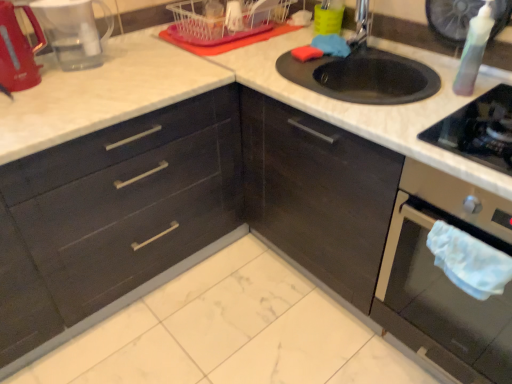
Where is `free space to the back side of transparent plastic bottle at upper right`? free space to the back side of transparent plastic bottle at upper right is located at coordinates (440, 75).